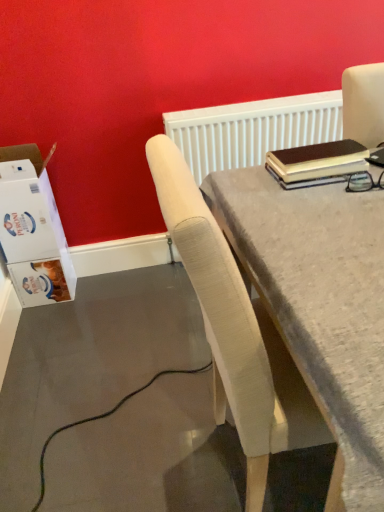
The width and height of the screenshot is (384, 512). I want to click on free spot above white textured radiator at upper center (from a real-world perspective), so click(253, 102).